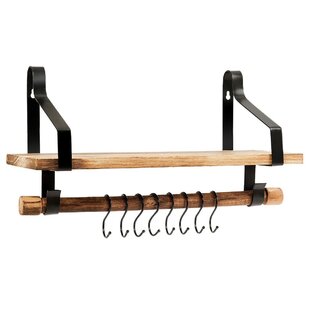
The width and height of the screenshot is (310, 310). Find the location of `2nd black hook`. 2nd black hook is located at coordinates (122, 236).